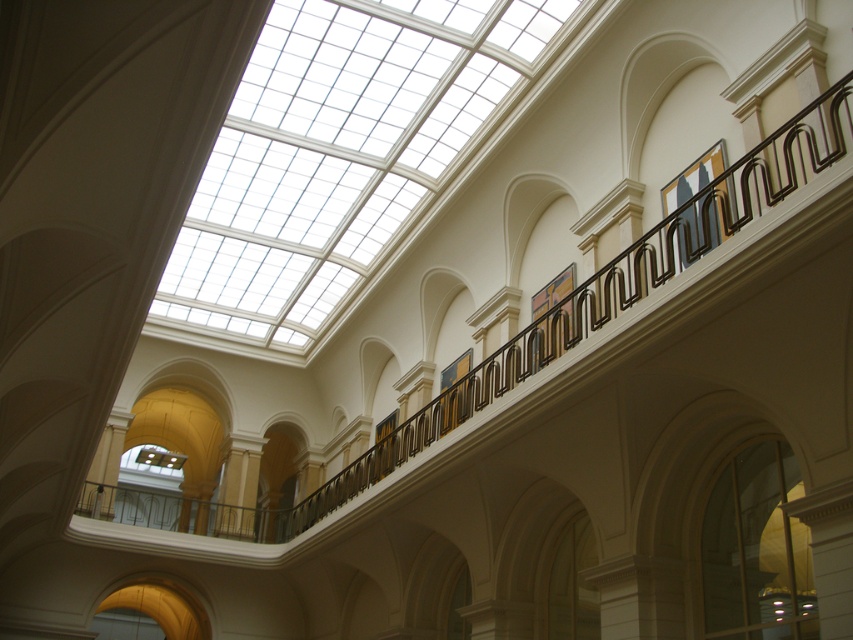
Can you confirm if transparent glass skylight at upper center is taller than matte black painting at upper right?

Yes, transparent glass skylight at upper center is taller than matte black painting at upper right.

Is transparent glass skylight at upper center bigger than matte black painting at upper right?

Yes, transparent glass skylight at upper center is bigger than matte black painting at upper right.

Identify the location of transparent glass skylight at upper center. (344, 154).

Does transparent glass window at lower right have a lesser width compared to matte black painting at upper right?

Correct, transparent glass window at lower right's width is less than matte black painting at upper right's.

Is transparent glass window at lower right closer to the viewer compared to matte black painting at upper right?

No, transparent glass window at lower right is further to the viewer.

The image size is (853, 640). I want to click on transparent glass window at lower right, so pyautogui.click(x=757, y=550).

Is transparent glass skylight at upper center shorter than transparent glass window at lower right?

In fact, transparent glass skylight at upper center may be taller than transparent glass window at lower right.

Between transparent glass skylight at upper center and transparent glass window at lower right, which one appears on the right side from the viewer's perspective?

transparent glass window at lower right is more to the right.

Is point (317, 88) less distant than point (759, 634)?

No, it is behind (759, 634).

At what (x,y) coordinates should I click in order to perform the action: click on transparent glass skylight at upper center. Please return your answer as a coordinate pair (x, y). Looking at the image, I should click on (344, 154).